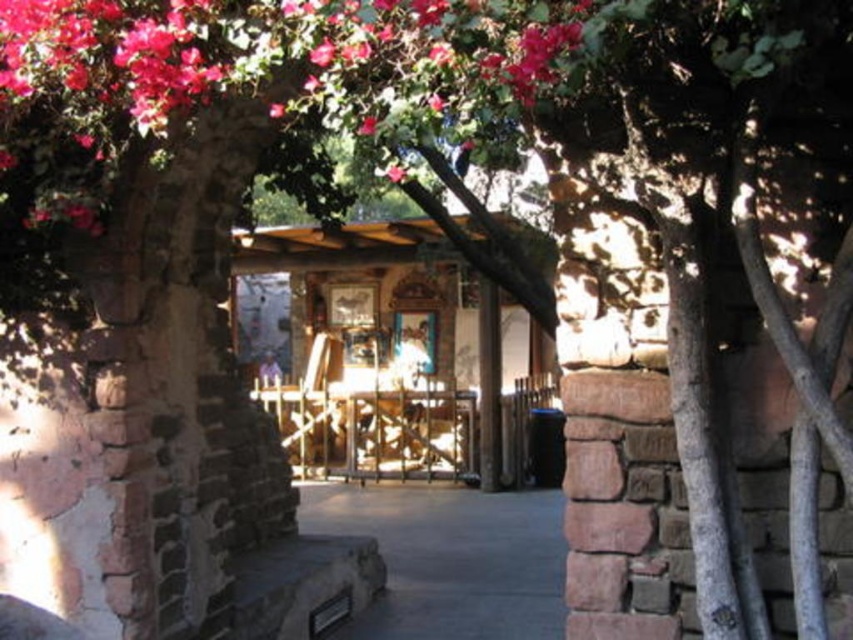
Question: Does vibrant pink petals at upper center appear over gray concrete pavement at center?

Choices:
 (A) no
 (B) yes

Answer: (B)

Question: Is vibrant pink petals at upper center to the right of gray concrete pavement at center from the viewer's perspective?

Choices:
 (A) yes
 (B) no

Answer: (B)

Question: Does vibrant pink petals at upper center have a greater width compared to gray concrete pavement at center?

Choices:
 (A) no
 (B) yes

Answer: (A)

Question: Among these points, which one is farthest from the camera?

Choices:
 (A) (444, 621)
 (B) (254, 93)

Answer: (A)